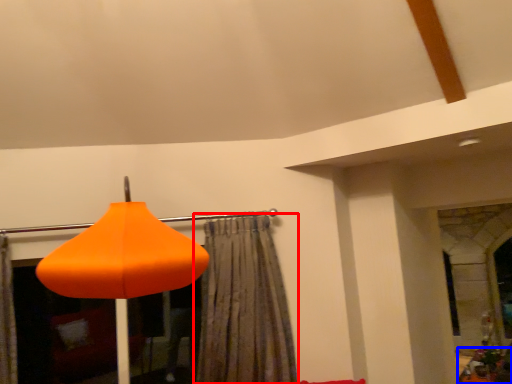
Question: Among these objects, which one is farthest to the camera, curtain (highlighted by a red box) or furniture (highlighted by a blue box)?

Choices:
 (A) curtain
 (B) furniture

Answer: (B)